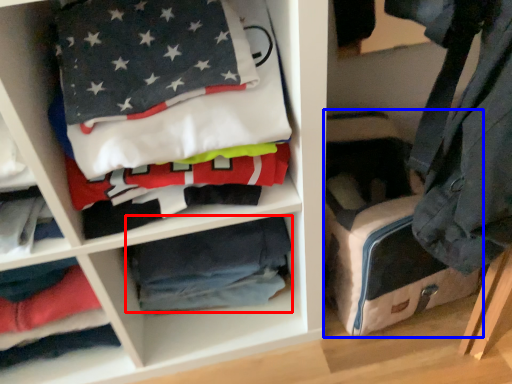
Question: Among these objects, which one is nearest to the camera, material (highlighted by a red box) or pack (highlighted by a blue box)?

Choices:
 (A) material
 (B) pack

Answer: (B)